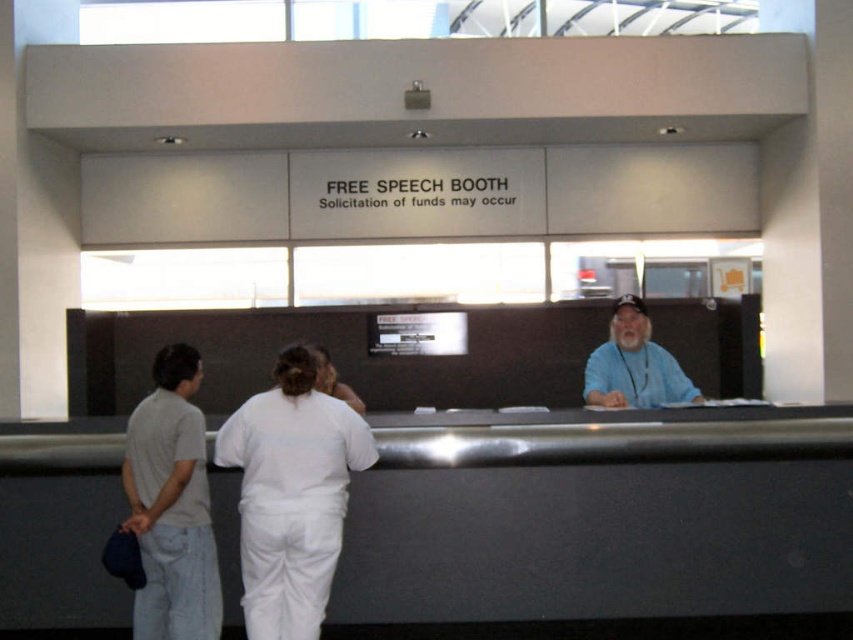
You are a visitor at the counter and need to place a document on the metallic gray desk at center. From your perspective facing the counter, where should you position yourself relative to the white matte uniform at center to reach the desk?

You should position yourself to the right of the white matte uniform at center because the metallic gray desk at center is located to the right of it.

Looking at this image, you are a visitor at the counter and need to reach the point marked at coordinates point (254, 545) from the point marked at coordinates point (625, 374). Which direction should you move relative to the counter?

You should move forward towards the front of the counter to reach point (254, 545) from point (625, 374) since it is in front of it.